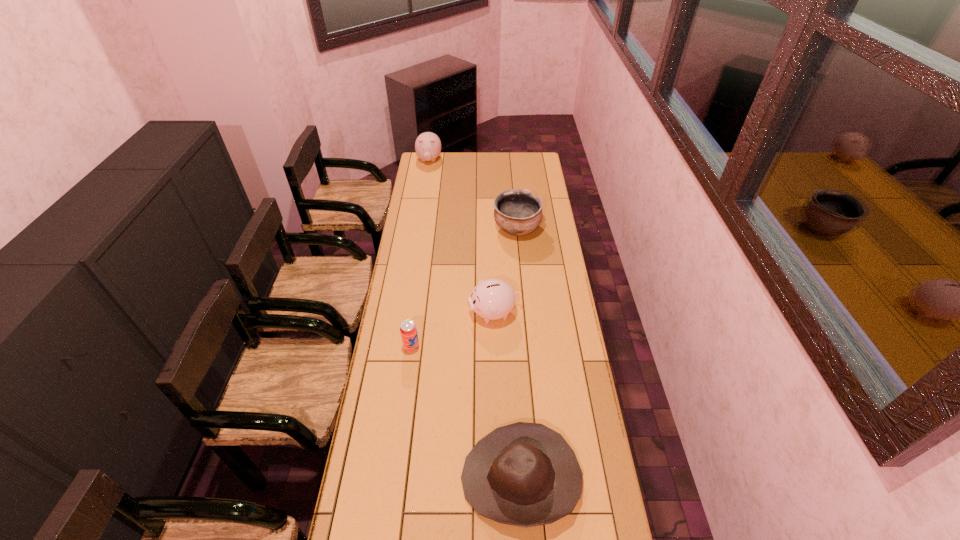
Locate an element on the screen. Image resolution: width=960 pixels, height=540 pixels. free region located on the back of the second nearest object is located at coordinates (418, 304).

The width and height of the screenshot is (960, 540). In order to click on free region located 0.180m on the back of the cowboy hat in this screenshot , I will do `click(515, 384)`.

At what (x,y) coordinates should I click in order to perform the action: click on object located at the far edge. Please return your answer as a coordinate pair (x, y). Image resolution: width=960 pixels, height=540 pixels. Looking at the image, I should click on (428, 145).

The width and height of the screenshot is (960, 540). I want to click on piggy bank at the left edge, so coord(428,145).

Find the location of a particular element. This screenshot has height=540, width=960. soda can at the left edge is located at coordinates (408, 330).

Where is `pottery located in the right edge section of the desktop`? This screenshot has width=960, height=540. pottery located in the right edge section of the desktop is located at coordinates (517, 212).

Where is `cowboy hat located in the right edge section of the desktop`? The image size is (960, 540). cowboy hat located in the right edge section of the desktop is located at coordinates (523, 474).

The width and height of the screenshot is (960, 540). In order to click on object that is positioned at the far left corner in this screenshot , I will do `click(428, 145)`.

Where is `vacant area at the far edge of the desktop`? The image size is (960, 540). vacant area at the far edge of the desktop is located at coordinates (482, 155).

In the image, there is a desktop. Identify the location of free space at the left edge. (425, 261).